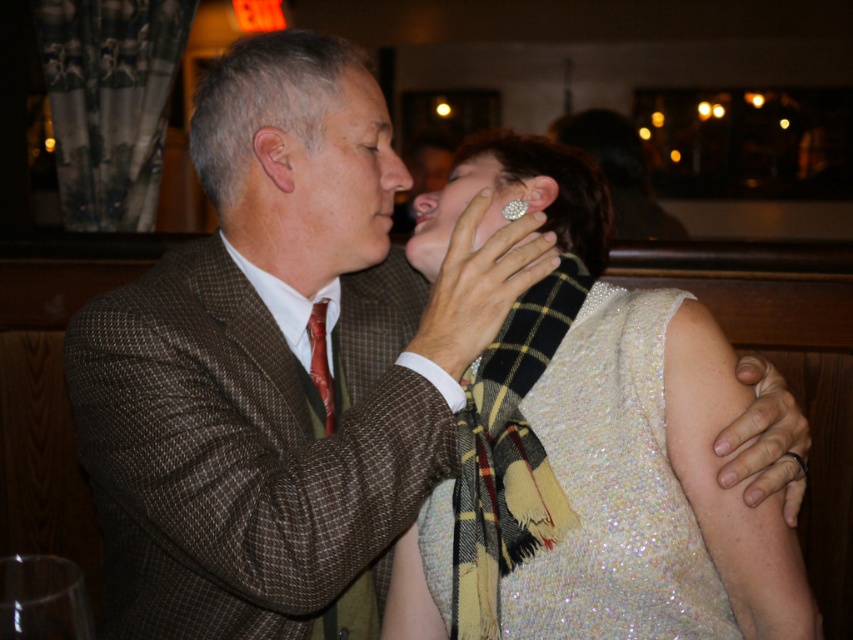
You are a photographer trying to capture a closeup shot of both the shiny silk tie at center and the diamond shiny ring at ear. Since you can only focus on one object at a time, which one should you choose to ensure the other is still in the background?

You should focus on the shiny silk tie at center because it is closer to the viewer, allowing the diamond shiny ring at ear to remain in the background.

What is the exact coordinate of the shiny silk tie at center?

The shiny silk tie at center is located at point (321,362).